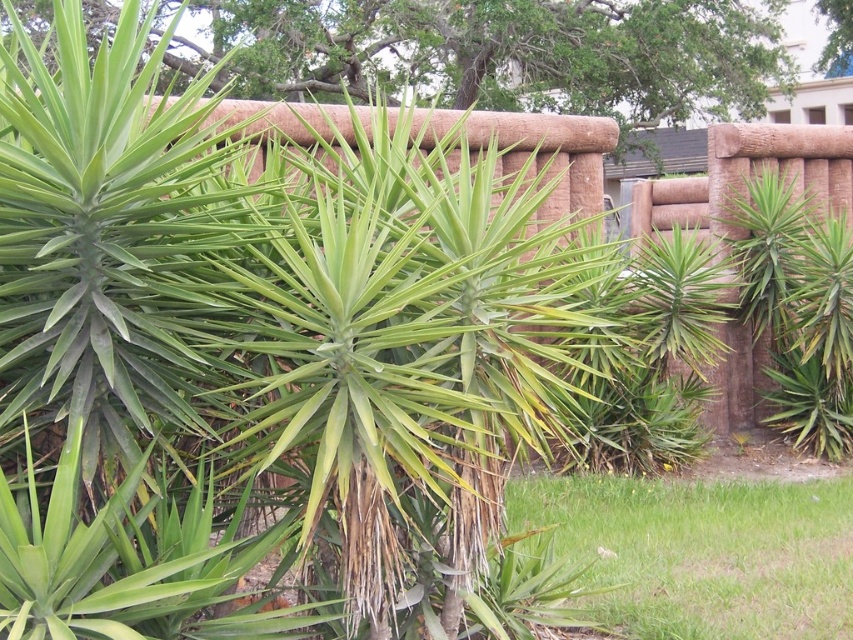
You are standing in the landscape scene and want to walk from the point closer to you to the farther point. Which path would you take between the two points, point (426, 84) and point (743, 545)?

You should walk from point (426, 84) to point (743, 545) because point (426, 84) is closer to you, so moving towards point (743, 545) would take you away from your current position.

You are a gardener who needs to determine which object in the scene requires more water. Based on their sizes, which one is the green leafy plant at center or the green grass at lower right?

The green leafy plant at center has a larger size compared to the green grass at lower right, so it likely requires more water.

You are a gardener looking at this landscape. You need to water both the green leafy plant at center and the green grass at lower right. Which one is closer to you?

The green leafy plant at center is closer to you because the green grass at lower right is behind it.